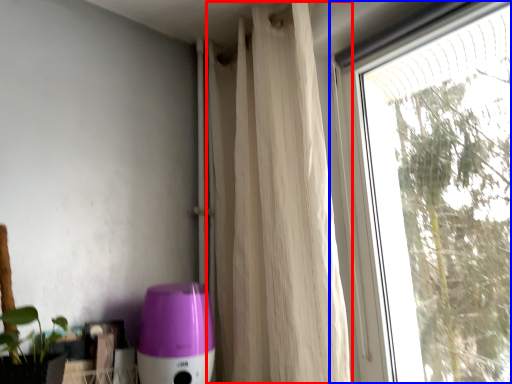
Question: Among these objects, which one is nearest to the camera, curtain (highlighted by a red box) or window (highlighted by a blue box)?

Choices:
 (A) curtain
 (B) window

Answer: (B)